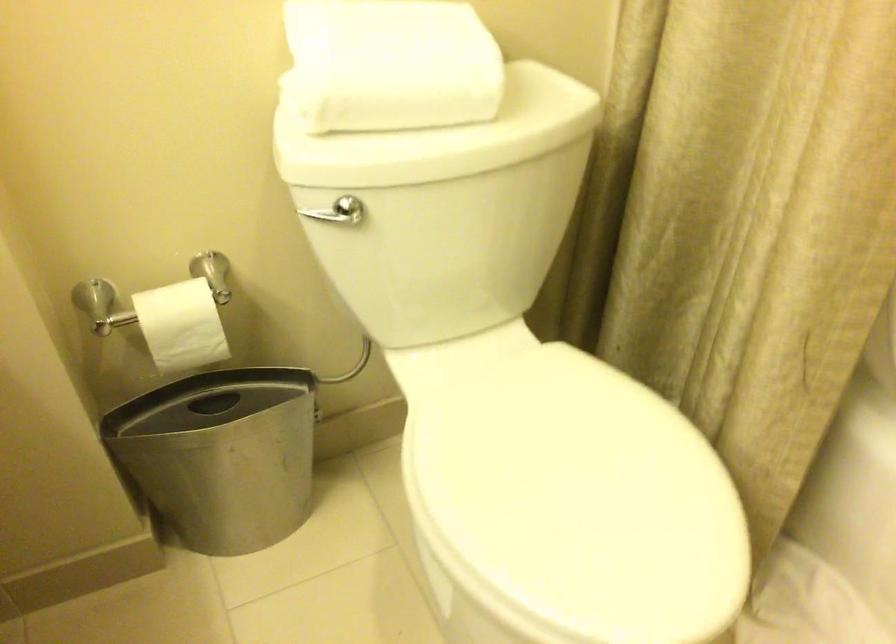
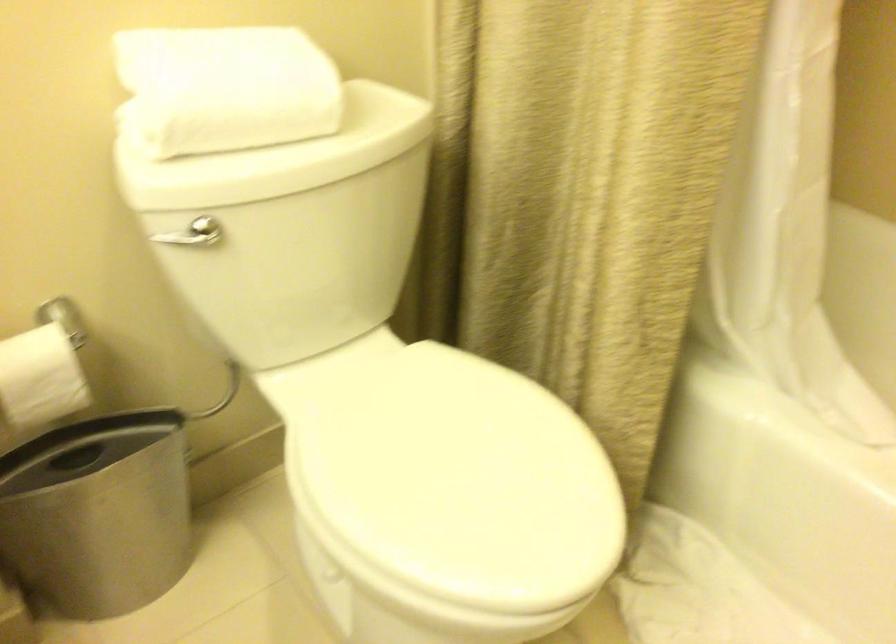
Find the pixel in the second image that matches (x=183, y=328) in the first image.

(39, 377)